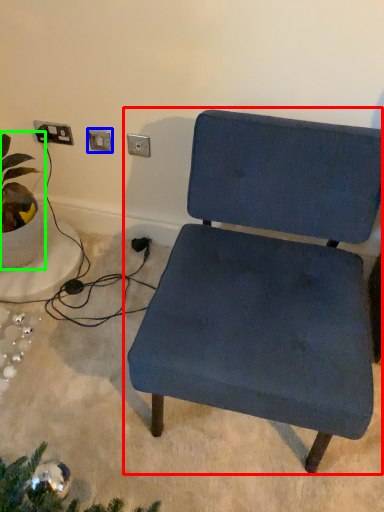
Question: Which object is positioned farthest from chair (highlighted by a red box)? Select from electric outlet (highlighted by a blue box) and houseplant (highlighted by a green box).

Choices:
 (A) electric outlet
 (B) houseplant

Answer: (B)